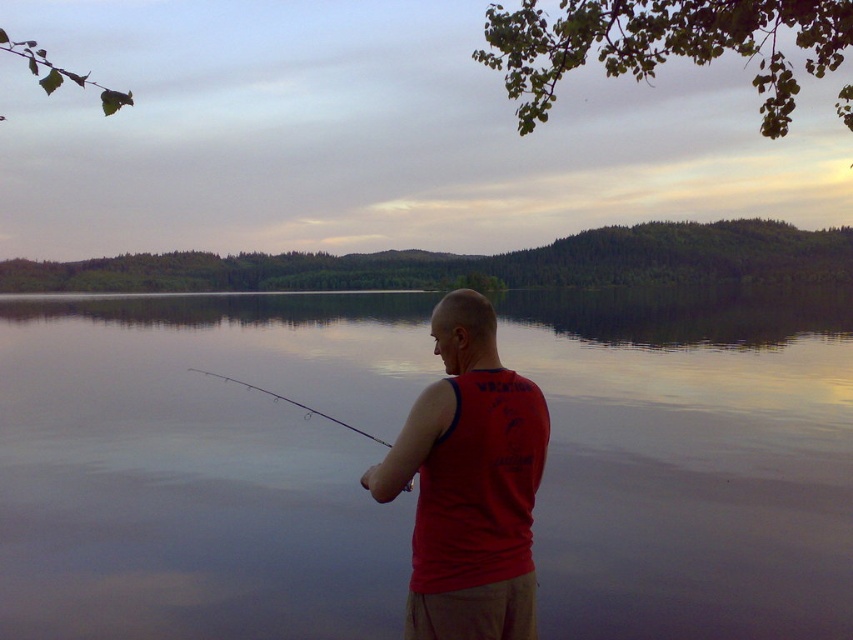
Question: Can you confirm if smooth water at center is thinner than red matte tank top at center?

Choices:
 (A) no
 (B) yes

Answer: (A)

Question: Among these objects, which one is farthest from the camera?

Choices:
 (A) smooth water at center
 (B) red matte tank top at center

Answer: (A)

Question: Which of the following is the farthest from the observer?

Choices:
 (A) smooth water at center
 (B) red matte tank top at center

Answer: (A)

Question: Considering the relative positions of smooth water at center and red matte tank top at center in the image provided, where is smooth water at center located with respect to red matte tank top at center?

Choices:
 (A) left
 (B) right

Answer: (A)

Question: Can you confirm if smooth water at center is positioned to the left of red matte tank top at center?

Choices:
 (A) no
 (B) yes

Answer: (B)

Question: Which point is closer to the camera?

Choices:
 (A) smooth water at center
 (B) red matte tank top at center

Answer: (B)